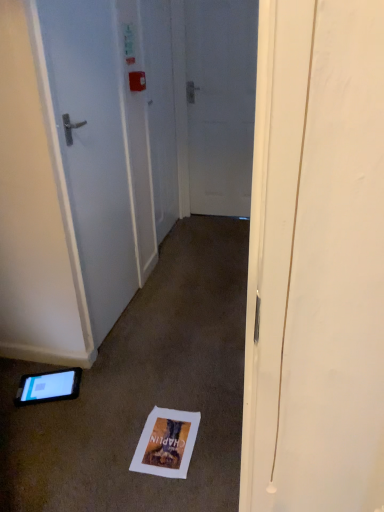
The image size is (384, 512). In order to click on free space to the right of white glossy door at left, marked as the 2th door in a back-to-front arrangement in this screenshot , I will do `click(175, 316)`.